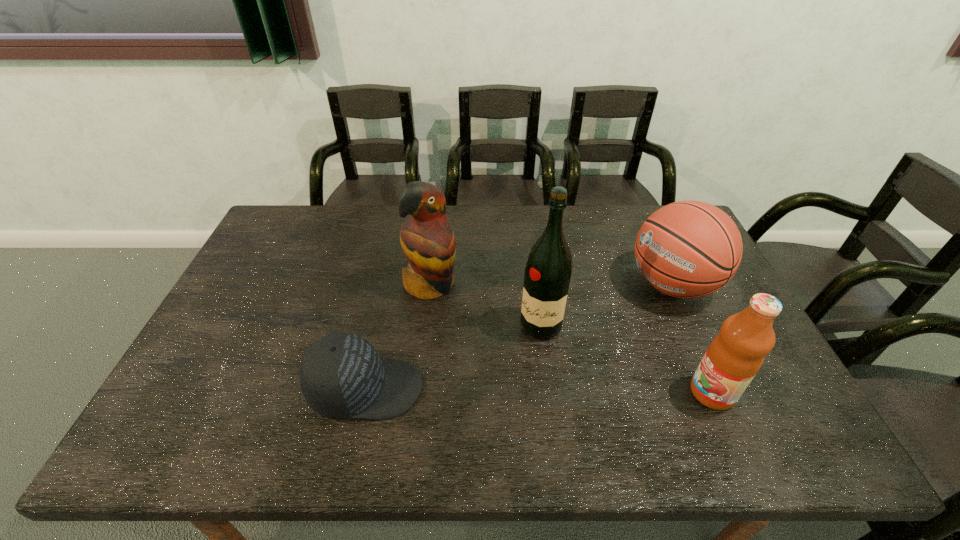
The image size is (960, 540). In order to click on free point that satisfies the following two spatial constraints: 1. on the back side of the parrot; 2. on the right side of the basketball in this screenshot , I will do `click(431, 285)`.

Where is `vacant region that satisfies the following two spatial constraints: 1. on the front side of the fruit juice; 2. on the front label of the liquor`? This screenshot has width=960, height=540. vacant region that satisfies the following two spatial constraints: 1. on the front side of the fruit juice; 2. on the front label of the liquor is located at coordinates (550, 393).